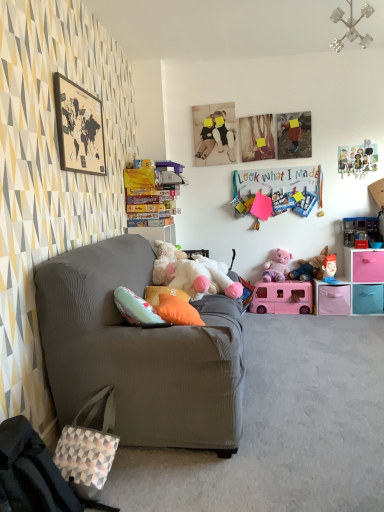
Question: Which direction should I rotate to look at fluffy white teddy bear at center, marked as the 1th toy in a left-to-right arrangement?

Choices:
 (A) right
 (B) left

Answer: (A)

Question: Is matte gray couch at left smaller than plush pink teddy bear at right, the 3th toy in the right-to-left sequence?

Choices:
 (A) no
 (B) yes

Answer: (A)

Question: From the image's perspective, does matte gray couch at left appear lower than plush pink teddy bear at right, the 3th toy in the right-to-left sequence?

Choices:
 (A) no
 (B) yes

Answer: (B)

Question: Is matte gray couch at left positioned with its back to plush pink teddy bear at right, which is the 4th toy in left-to-right order?

Choices:
 (A) yes
 (B) no

Answer: (B)

Question: From the image's perspective, does matte gray couch at left appear higher than plush pink teddy bear at right, the 3th toy in the right-to-left sequence?

Choices:
 (A) no
 (B) yes

Answer: (A)

Question: Could plush pink teddy bear at right, which is the 4th toy in left-to-right order, be considered to be inside matte gray couch at left?

Choices:
 (A) no
 (B) yes

Answer: (A)

Question: Is matte gray couch at left located outside plush pink teddy bear at right, the 3th toy in the right-to-left sequence?

Choices:
 (A) yes
 (B) no

Answer: (A)

Question: From the image's perspective, is pink plastic van at center, positioned as the 3th toy in left-to-right order, above wooden map at upper left?

Choices:
 (A) yes
 (B) no

Answer: (B)

Question: Is pink plastic van at center, the fourth toy positioned from the right, behind wooden map at upper left?

Choices:
 (A) yes
 (B) no

Answer: (A)

Question: Considering the relative sizes of pink plastic van at center, positioned as the 3th toy in left-to-right order, and wooden map at upper left in the image provided, is pink plastic van at center, positioned as the 3th toy in left-to-right order, taller than wooden map at upper left?

Choices:
 (A) no
 (B) yes

Answer: (A)

Question: Does pink plastic van at center, the fourth toy positioned from the right, touch wooden map at upper left?

Choices:
 (A) no
 (B) yes

Answer: (A)

Question: Is pink plastic van at center, the fourth toy positioned from the right, aimed at wooden map at upper left?

Choices:
 (A) yes
 (B) no

Answer: (B)

Question: Does pink plastic van at center, the fourth toy positioned from the right, have a smaller size compared to wooden map at upper left?

Choices:
 (A) yes
 (B) no

Answer: (B)

Question: From the image's perspective, would you say orange fabric pillow at center is shown under metallic plastic toy at upper right, arranged as the sixth toy when viewed from the left?

Choices:
 (A) yes
 (B) no

Answer: (A)